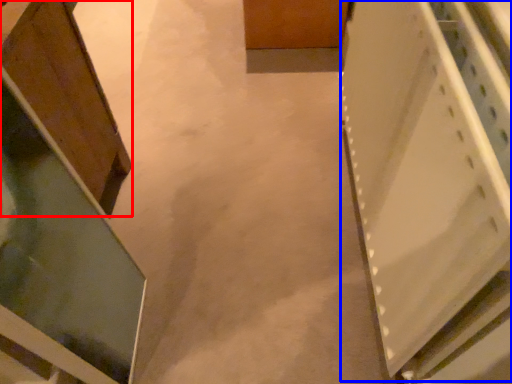
Question: Which object is closer to the camera taking this photo, cabinetry (highlighted by a red box) or cabinetry (highlighted by a blue box)?

Choices:
 (A) cabinetry
 (B) cabinetry

Answer: (B)